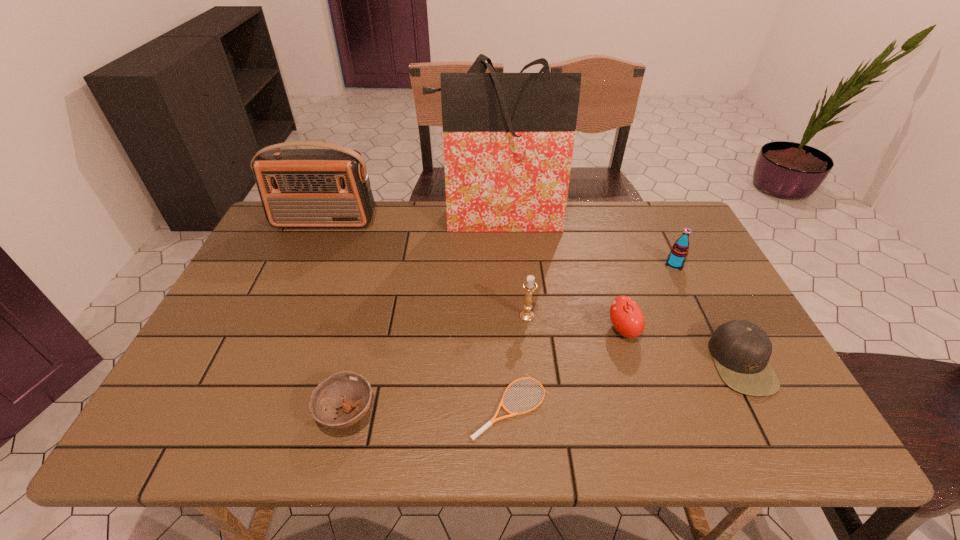
At what (x,y) coordinates should I click in order to perform the action: click on free space between the second tallest object and the shortest object. Please return your answer as a coordinate pair (x, y). Image resolution: width=960 pixels, height=540 pixels. Looking at the image, I should click on (418, 314).

At what (x,y) coordinates should I click in order to perform the action: click on object that is the sixth closest to the tallest object. Please return your answer as a coordinate pair (x, y). The width and height of the screenshot is (960, 540). Looking at the image, I should click on (493, 420).

Select which object is the fifth closest to the shopping bag. Please provide its 2D coordinates. Your answer should be formatted as a tuple, i.e. [(x, y)], where the tuple contains the x and y coordinates of a point satisfying the conditions above.

[(741, 350)]

Identify the location of vacant space that satisfies the following two spatial constraints: 1. on the front-facing side of the bowl; 2. on the left side of the radio receiver. (241, 413).

Locate an element on the screen. free spot that satisfies the following two spatial constraints: 1. on the front side of the tallest object; 2. on the right side of the apple is located at coordinates (502, 330).

You are a GUI agent. You are given a task and a screenshot of the screen. Output one action in this format:
    pyautogui.click(x=<x>, y=<y>)
    Task: Click on the free space that satisfies the following two spatial constraints: 1. on the front side of the tennis racket; 2. on the left side of the shopping bag
    The image size is (960, 540).
    Given the screenshot: What is the action you would take?
    pyautogui.click(x=506, y=406)

Find the location of a particular element. The width and height of the screenshot is (960, 540). free spot that satisfies the following two spatial constraints: 1. on the front-facing side of the radio receiver; 2. on the right side of the shortest object is located at coordinates (244, 406).

The image size is (960, 540). Identify the location of free space that satisfies the following two spatial constraints: 1. on the front-facing side of the seventh shortest object; 2. on the right side of the candle holder. pos(283,316).

Image resolution: width=960 pixels, height=540 pixels. Identify the location of free space that satisfies the following two spatial constraints: 1. on the front side of the fourth shortest object; 2. on the right side of the shopping bag. pyautogui.click(x=502, y=330).

This screenshot has width=960, height=540. Identify the location of vacant space that satisfies the following two spatial constraints: 1. on the front-facing side of the radio receiver; 2. on the right side of the candle holder. (283, 316).